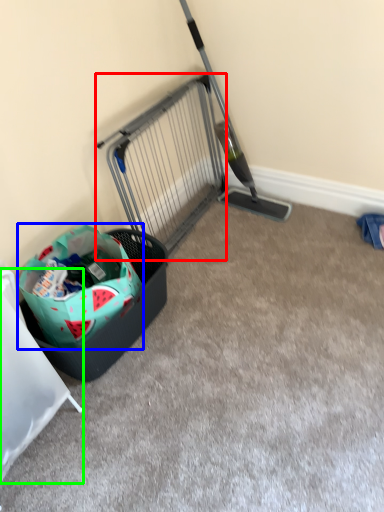
Question: Considering the real-world distances, which object is closest to cage (highlighted by a red box)? shopping bag (highlighted by a blue box) or furniture (highlighted by a green box).

Choices:
 (A) shopping bag
 (B) furniture

Answer: (A)